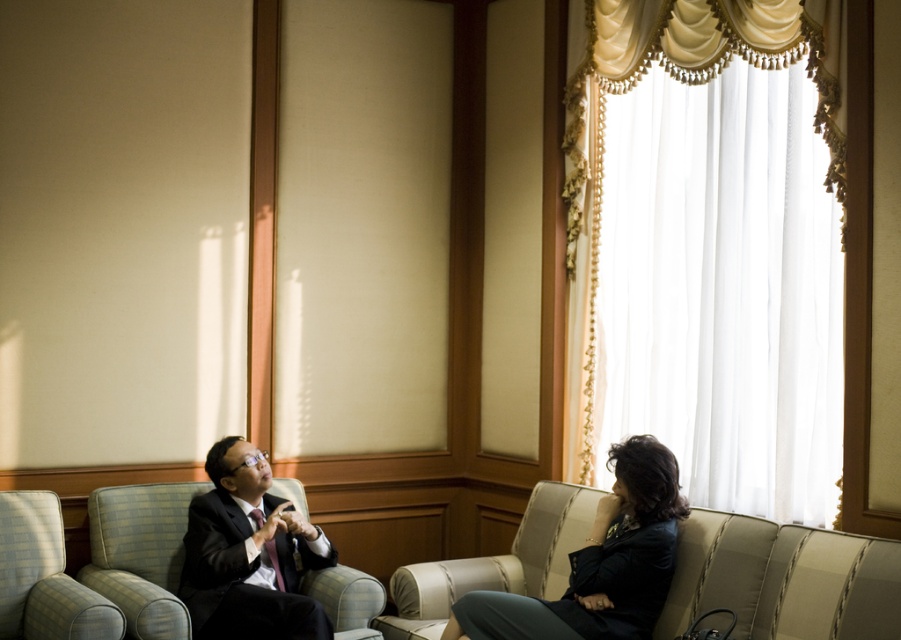
Question: Which point is closer to the camera?

Choices:
 (A) black suit at left
 (B) beige leather couch at lower right
 (C) matte black suit at left
 (D) dark blue fabric jacket at lower right

Answer: (C)

Question: Is the position of beige leather couch at lower right more distant than that of black suit at left?

Choices:
 (A) no
 (B) yes

Answer: (B)

Question: Which object is positioned closest to the black suit at left?

Choices:
 (A) matte black suit at left
 (B) beige leather couch at lower right
 (C) dark blue fabric jacket at lower right

Answer: (A)

Question: In this image, where is beige leather couch at lower right located relative to dark blue fabric jacket at lower right?

Choices:
 (A) left
 (B) right

Answer: (A)

Question: Among these points, which one is farthest from the camera?

Choices:
 (A) (653, 552)
 (B) (199, 632)
 (C) (634, 442)
 (D) (815, 596)

Answer: (C)

Question: Can you confirm if beige leather couch at lower right is thinner than matte black suit at left?

Choices:
 (A) yes
 (B) no

Answer: (B)